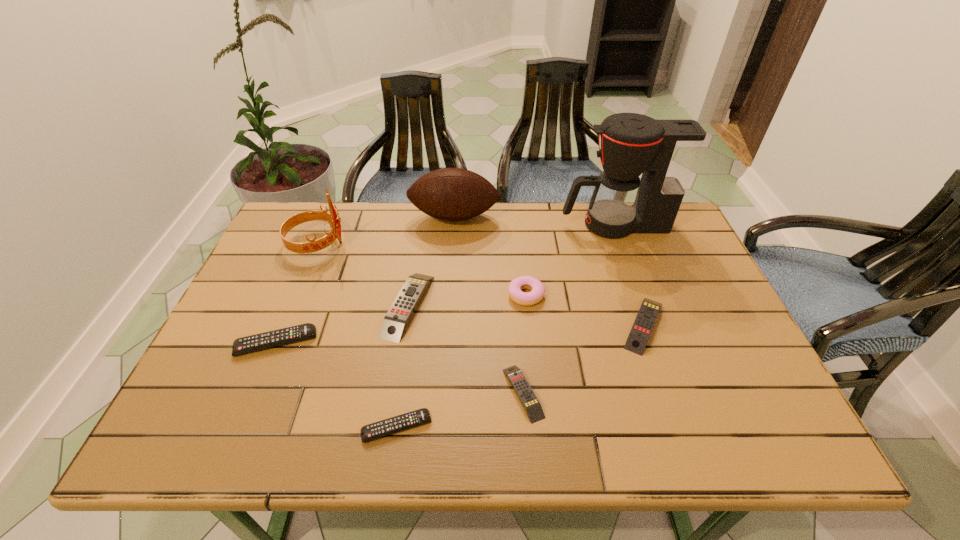
Where is `vacant area that lies between the tallest remote control and the fourth remote control from left to right`? This screenshot has height=540, width=960. vacant area that lies between the tallest remote control and the fourth remote control from left to right is located at coordinates (466, 349).

You are a GUI agent. You are given a task and a screenshot of the screen. Output one action in this format:
    pyautogui.click(x=<x>, y=<y>)
    Task: Click on the free space that is in between the tiara and the second biggest yellow remote control
    This screenshot has width=960, height=540.
    Given the screenshot: What is the action you would take?
    pyautogui.click(x=480, y=284)

Find the location of a particular element. This screenshot has width=960, height=540. vacant region between the third tallest object and the leftmost yellow remote control is located at coordinates tap(431, 261).

You are a GUI agent. You are given a task and a screenshot of the screen. Output one action in this format:
    pyautogui.click(x=<x>, y=<y>)
    Task: Click on the empty location between the shortest object and the coffee maker
    
    Given the screenshot: What is the action you would take?
    (505, 326)

The image size is (960, 540). I want to click on vacant space in between the leftmost yellow remote control and the smaller black remote control, so click(x=402, y=366).

Image resolution: width=960 pixels, height=540 pixels. Identify the location of free area in between the leftmost yellow remote control and the football. (431, 261).

Where is `vacant region between the sixth tallest object and the biggest yellow remote control`? vacant region between the sixth tallest object and the biggest yellow remote control is located at coordinates (526, 315).

Image resolution: width=960 pixels, height=540 pixels. In order to click on free space between the leftmost remote control and the second remote control from right to left in this screenshot , I will do `click(399, 368)`.

Locate an element on the screen. unoccupied area between the left black remote control and the tiara is located at coordinates (296, 293).

Identify which object is the second nearest to the biggest yellow remote control. Please provide its 2D coordinates. Your answer should be formatted as a tuple, i.e. [(x, y)], where the tuple contains the x and y coordinates of a point satisfying the conditions above.

[(332, 218)]